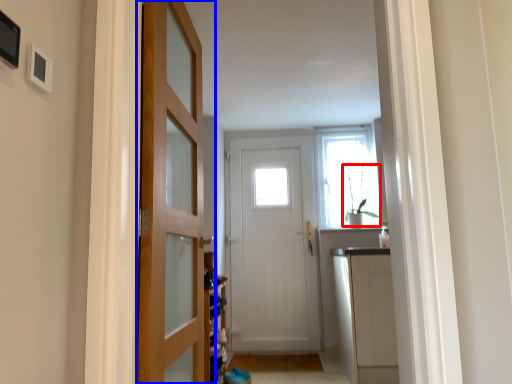
Question: Which object appears farthest to the camera in this image, plant (highlighted by a red box) or door (highlighted by a blue box)?

Choices:
 (A) plant
 (B) door

Answer: (A)